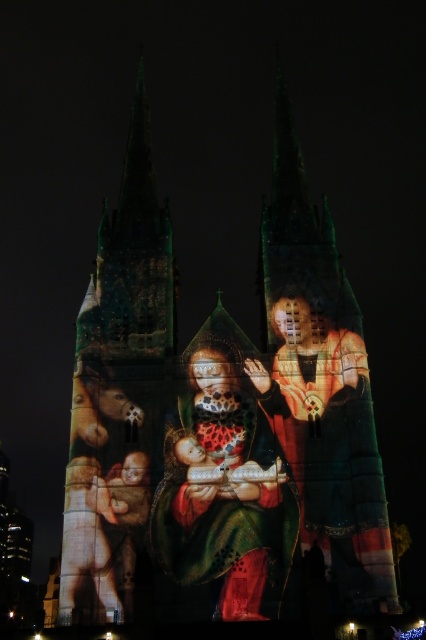
You are an art student analyzing the projection mapping on the cathedral. You notice two elements in the central area of the projection. One is the matte gold and red fabric at center, and the other is the matte gold robe at center. Which of these two elements is shorter in height?

The matte gold and red fabric at center is not as tall as the matte gold robe at center, so the matte gold and red fabric at center is shorter in height.

You are an art historian examining the projection mapping on the cathedral. You notice two elements in the central area of the projection. One is labeled as the matte gold and red fabric at center, and the other is the matte gold robe at center. Based on the spatial arrangement, which of these two elements is located to the right side?

The matte gold robe at center is located to the right side because the matte gold and red fabric at center is positioned on its left side.

You are an event planner setting up a light show for the cathedral. You need to ensure that the matte gold and red fabric at center and the matte gold robe at center are both visible in the projection. Given their sizes, which object should be placed closer to the front of the projection area to ensure visibility?

The matte gold robe at center should be placed closer to the front of the projection area because its width is smaller than the matte gold and red fabric at center. This placement ensures both objects remain visible without one overshadowing the other.